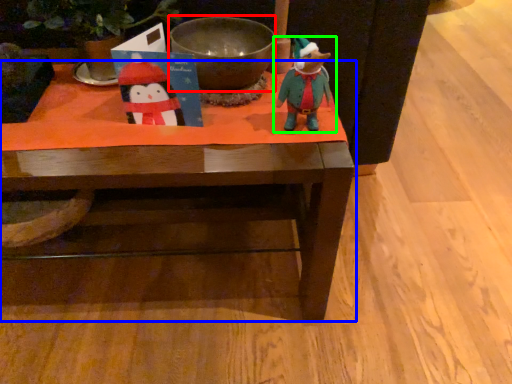
Question: Which object is positioned farthest from bowl (highlighted by a red box)? Select from table (highlighted by a blue box) and toy (highlighted by a green box).

Choices:
 (A) table
 (B) toy

Answer: (A)